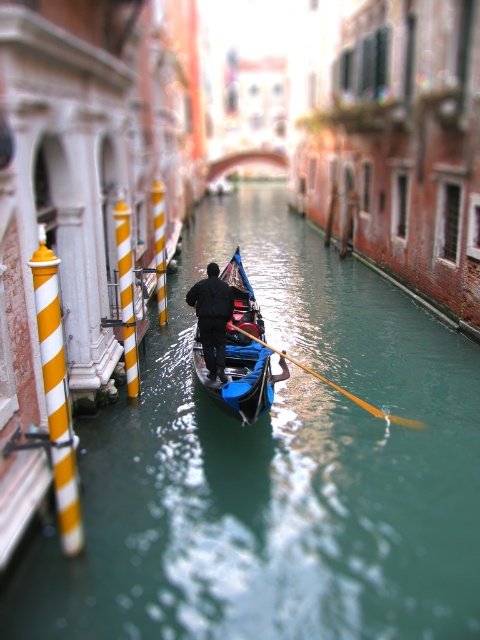
Can you confirm if shiny blue gondola at center is thinner than black matte jacket at center?

Incorrect, shiny blue gondola at center's width is not less than black matte jacket at center's.

Does shiny blue gondola at center appear on the right side of black matte jacket at center?

Yes, shiny blue gondola at center is to the right of black matte jacket at center.

What do you see at coordinates (241, 353) in the screenshot? The width and height of the screenshot is (480, 640). I see `shiny blue gondola at center` at bounding box center [241, 353].

This screenshot has height=640, width=480. What are the coordinates of `shiny blue gondola at center` in the screenshot? It's located at (241, 353).

Does green glossy water at center have a greater width compared to shiny blue gondola at center?

Yes, green glossy water at center is wider than shiny blue gondola at center.

Is green glossy water at center thinner than shiny blue gondola at center?

In fact, green glossy water at center might be wider than shiny blue gondola at center.

Who is more distant from viewer, (352, 300) or (253, 413)?

The point (352, 300) is more distant.

Locate an element on the screen. The width and height of the screenshot is (480, 640). green glossy water at center is located at coordinates (276, 468).

Is green glossy water at center above black matte jacket at center?

No.

Is green glossy water at center taller than black matte jacket at center?

Correct, green glossy water at center is much taller as black matte jacket at center.

You are a GUI agent. You are given a task and a screenshot of the screen. Output one action in this format:
    pyautogui.click(x=<x>, y=<y>)
    Task: Click on the green glossy water at center
    This screenshot has width=480, height=640.
    Given the screenshot: What is the action you would take?
    pyautogui.click(x=276, y=468)